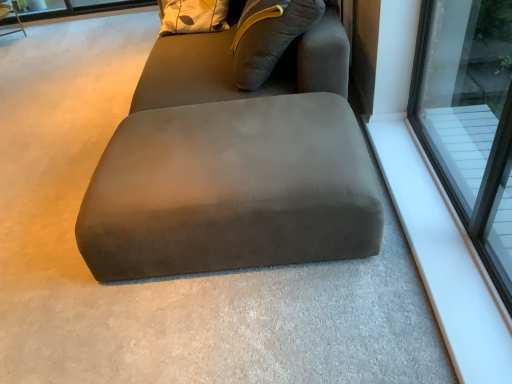
At what (x,y) coordinates should I click in order to perform the action: click on free space to the left of suede ottoman at center. Please return your answer as a coordinate pair (x, y). The height and width of the screenshot is (384, 512). Looking at the image, I should click on (51, 227).